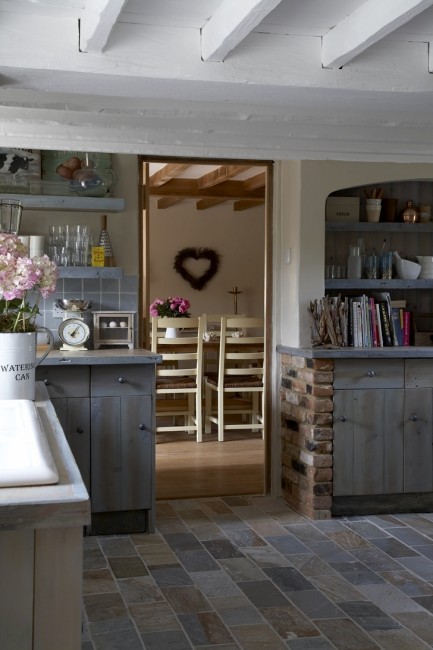
Identify the location of stone floor. (236, 604).